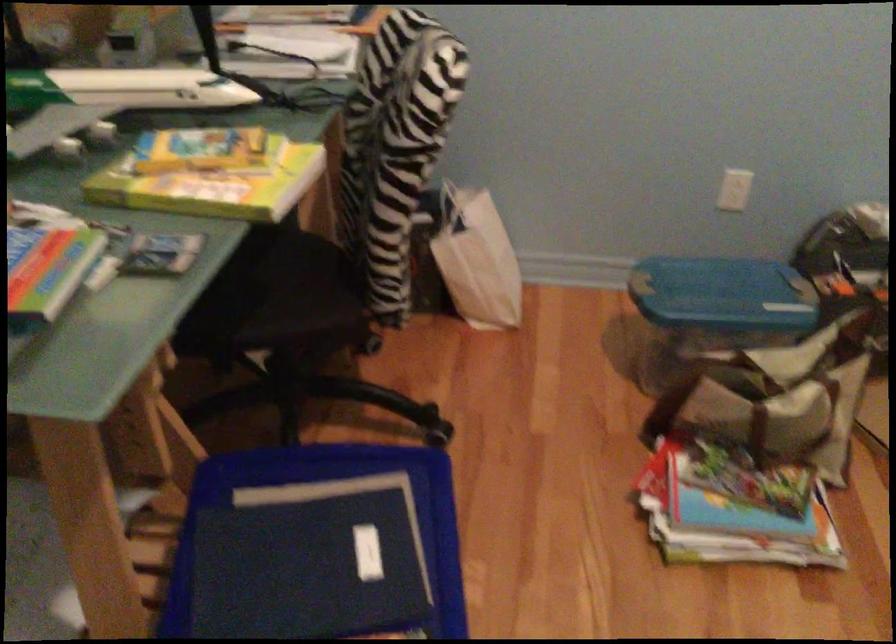
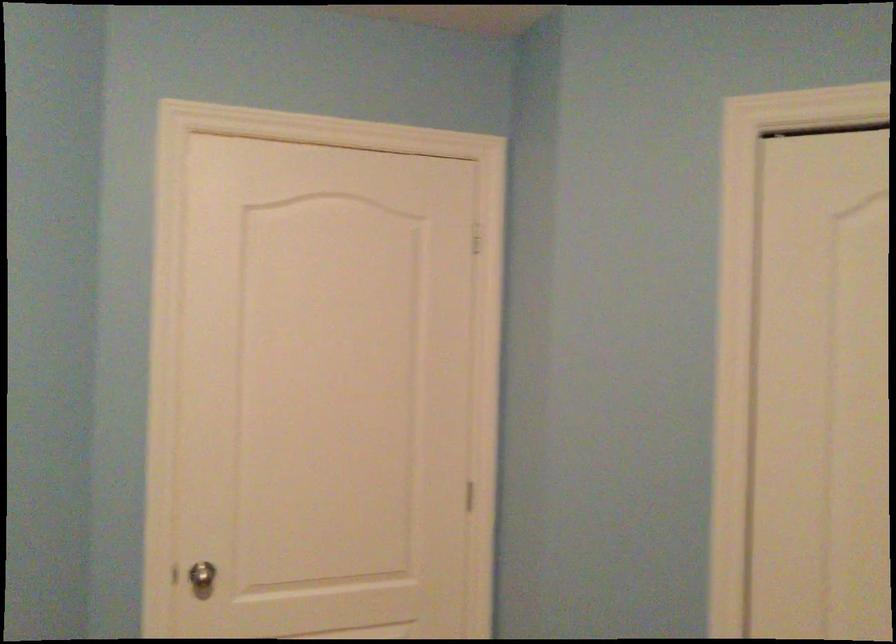
Question: The camera is either moving clockwise (left) or counter-clockwise (right) around the object. The first image is from the beginning of the video and the second image is from the end. Is the camera moving left or right when shooting the video?

Choices:
 (A) Left
 (B) Right

Answer: (A)